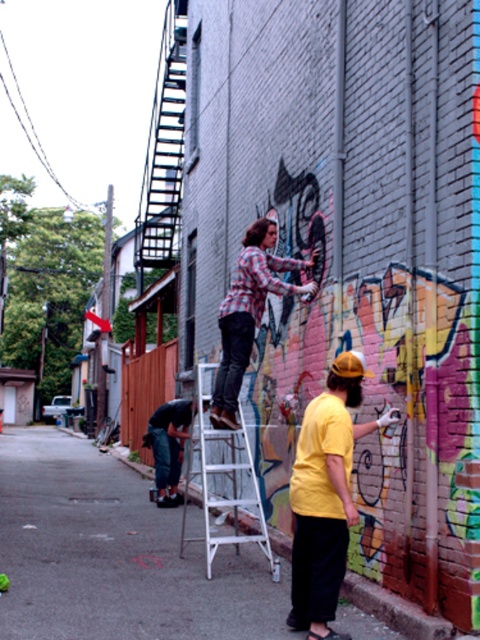
Does matte white ladder at center have a greater width compared to white metal ladder at center?

Yes.

Is point (236, 588) less distant than point (208, 429)?

Yes, it is.

Where is `matte white ladder at center`? Image resolution: width=480 pixels, height=640 pixels. matte white ladder at center is located at coordinates (115, 554).

Can you confirm if matte white ladder at center is positioned to the left of yellow matte shirt at lower right?

Yes, matte white ladder at center is to the left of yellow matte shirt at lower right.

Which is in front, point (350, 634) or point (312, 600)?

Point (312, 600) is in front.

You are a GUI agent. You are given a task and a screenshot of the screen. Output one action in this format:
    pyautogui.click(x=<x>, y=<y>)
    Task: Click on the matte white ladder at center
    The image size is (480, 640).
    Given the screenshot: What is the action you would take?
    pyautogui.click(x=115, y=554)

Between matte white ladder at center and denim pants at lower left, which one appears on the left side from the viewer's perspective?

Positioned to the left is matte white ladder at center.

Is point (58, 513) farther from camera compared to point (195, 406)?

Yes, it is behind point (195, 406).

At what (x,y) coordinates should I click in order to perform the action: click on matte white ladder at center. Please return your answer as a coordinate pair (x, y). Looking at the image, I should click on (115, 554).